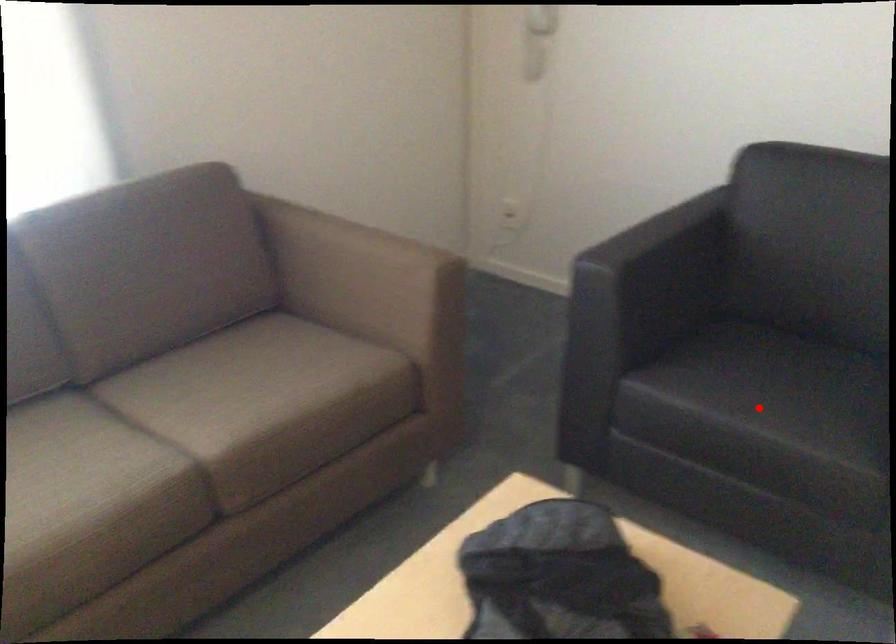
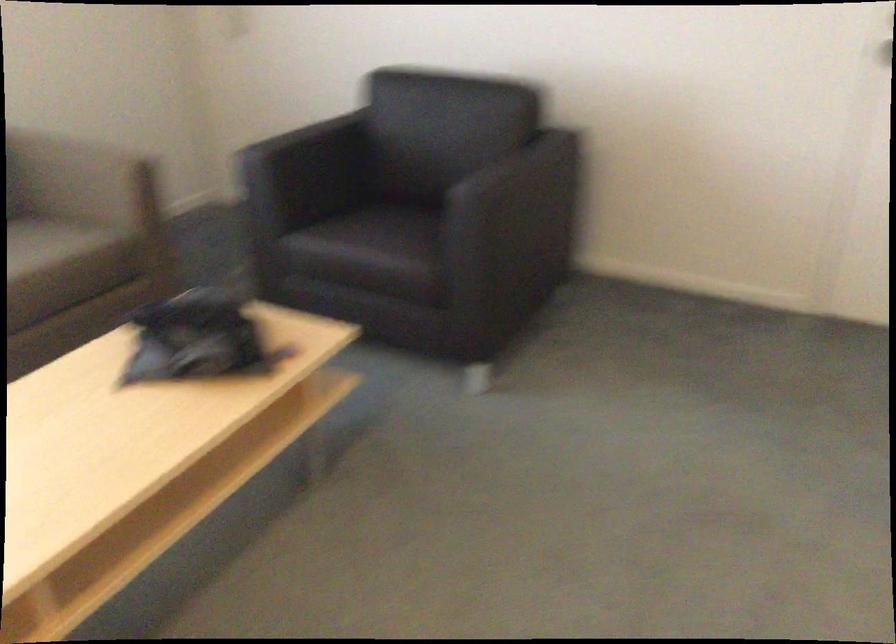
The point at the highlighted location is marked in the first image. Where is the corresponding point in the second image?

(368, 240)